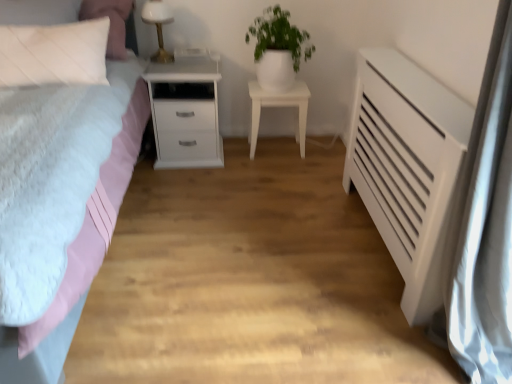
Identify the location of spots to the right of white matte nightstand at left, the 2th nightstand in the right-to-left sequence. (253, 166).